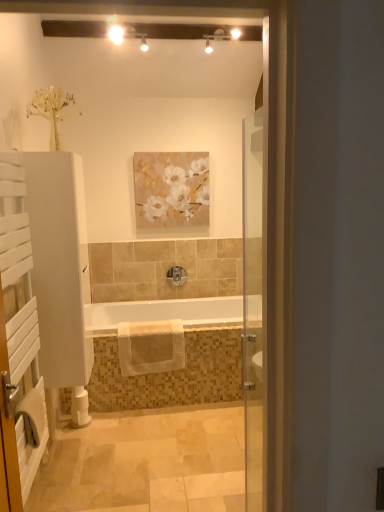
Question: Is white wooden towel rack at left behind polished chrome faucet at center?

Choices:
 (A) yes
 (B) no

Answer: (B)

Question: From a real-world perspective, is white wooden towel rack at left located beneath polished chrome faucet at center?

Choices:
 (A) no
 (B) yes

Answer: (A)

Question: Is white wooden towel rack at left in contact with polished chrome faucet at center?

Choices:
 (A) yes
 (B) no

Answer: (B)

Question: Is white wooden towel rack at left shorter than polished chrome faucet at center?

Choices:
 (A) no
 (B) yes

Answer: (A)

Question: Is white wooden towel rack at left at the left side of polished chrome faucet at center?

Choices:
 (A) no
 (B) yes

Answer: (B)

Question: Based on their sizes in the image, would you say white glossy bathtub at center is bigger or smaller than matte floral painting at upper center?

Choices:
 (A) big
 (B) small

Answer: (A)

Question: Which is correct: white glossy bathtub at center is inside matte floral painting at upper center, or outside of it?

Choices:
 (A) outside
 (B) inside

Answer: (A)

Question: From a real-world perspective, is white glossy bathtub at center physically located above or below matte floral painting at upper center?

Choices:
 (A) above
 (B) below

Answer: (B)

Question: Based on their positions, is white glossy bathtub at center located to the left or right of matte floral painting at upper center?

Choices:
 (A) right
 (B) left

Answer: (B)

Question: From their relative heights in the image, would you say white soft towel at lower left, arranged as the 2th bath towel when viewed from the right, is taller or shorter than beige textured towel at center, which is counted as the 1th bath towel, starting from the back?

Choices:
 (A) short
 (B) tall

Answer: (A)

Question: Is white soft towel at lower left, which is the first bath towel from left to right, to the left or to the right of beige textured towel at center, which ranks as the 1th bath towel in right-to-left order, in the image?

Choices:
 (A) right
 (B) left

Answer: (B)

Question: From the image's perspective, is white soft towel at lower left, which is the first bath towel from left to right, above or below beige textured towel at center, which ranks as the 1th bath towel in right-to-left order?

Choices:
 (A) below
 (B) above

Answer: (A)

Question: Relative to beige textured towel at center, which ranks as the 1th bath towel in right-to-left order, is white soft towel at lower left, which is the first bath towel from left to right, in front or behind?

Choices:
 (A) behind
 (B) front

Answer: (B)

Question: Is white soft towel at lower left, arranged as the 2th bath towel when viewed from the right, in front of or behind matte floral painting at upper center in the image?

Choices:
 (A) front
 (B) behind

Answer: (A)

Question: In terms of size, does white soft towel at lower left, the 2th bath towel from the back, appear bigger or smaller than matte floral painting at upper center?

Choices:
 (A) small
 (B) big

Answer: (A)